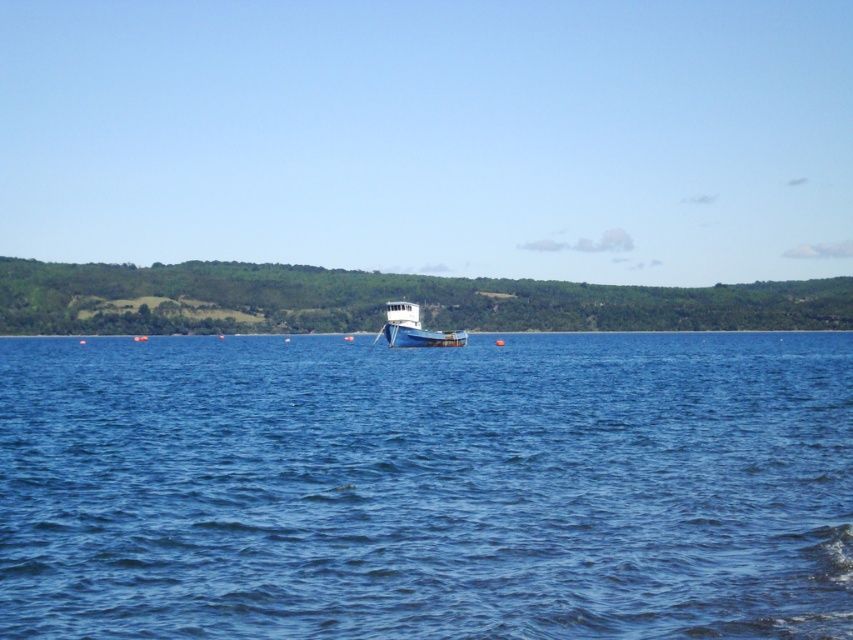
You are standing at the lakeside and see two points marked in the image. Which point is closer to you, point (785, 387) or point (425, 342)?

Point (785, 387) is in front of point (425, 342), so it is closer to you.

You are standing on the lakeside and see the blue wooden boat at center and the blue water at center. Which object is positioned to the right of the other?

The blue water at center is to the right of the blue wooden boat at center.